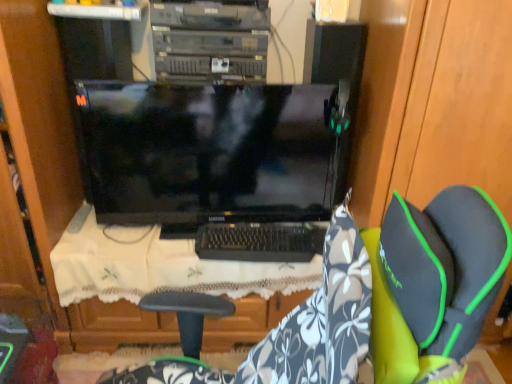
Question: Do you think white lace cloth at center is within wooden dresser at left, or outside of it?

Choices:
 (A) outside
 (B) inside

Answer: (A)

Question: Looking at their shapes, would you say white lace cloth at center is wider or thinner than wooden dresser at left?

Choices:
 (A) wide
 (B) thin

Answer: (B)

Question: Estimate the real-world distances between objects in this image. Which object is farther from the black plastic keyboard at center?

Choices:
 (A) white lace cloth at center
 (B) black glossy monitor at center
 (C) wooden dresser at left
 (D) floral fabric chair at center

Answer: (C)

Question: Which object is the closest to the wooden dresser at left?

Choices:
 (A) black plastic keyboard at center
 (B) white lace cloth at center
 (C) floral fabric chair at center
 (D) black glossy monitor at center

Answer: (B)